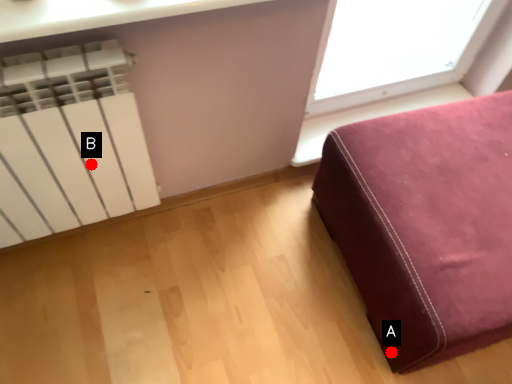
Question: Two points are circled on the image, labeled by A and B beside each circle. Among these points, which one is nearest to the camera?

Choices:
 (A) A is closer
 (B) B is closer

Answer: (B)